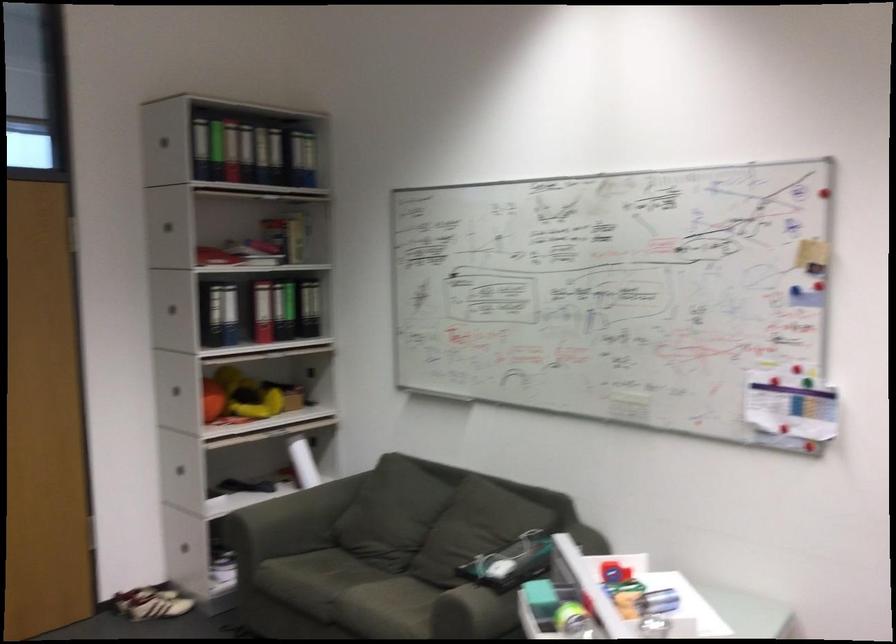
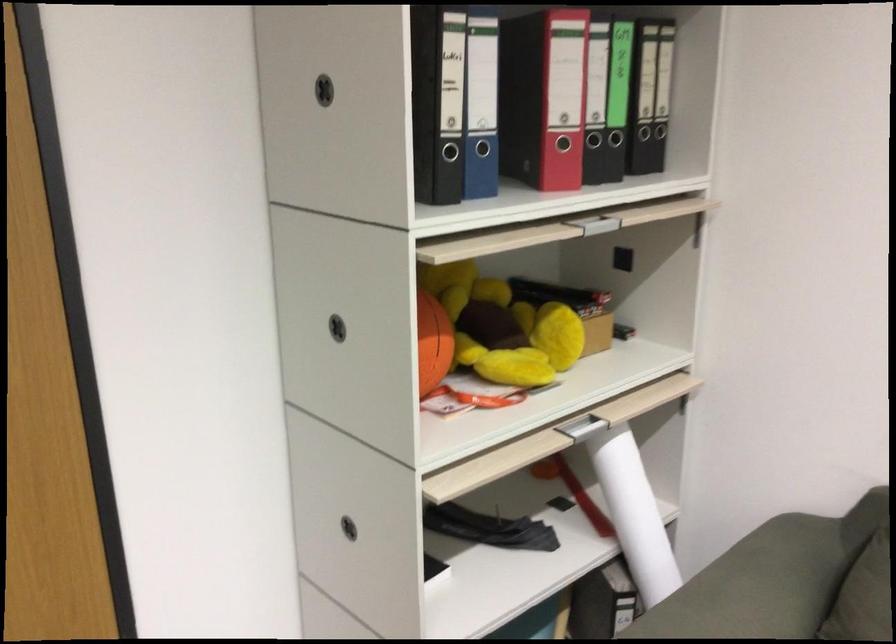
In the second image, find the point that corresponds to point (347, 377) in the first image.

(743, 260)